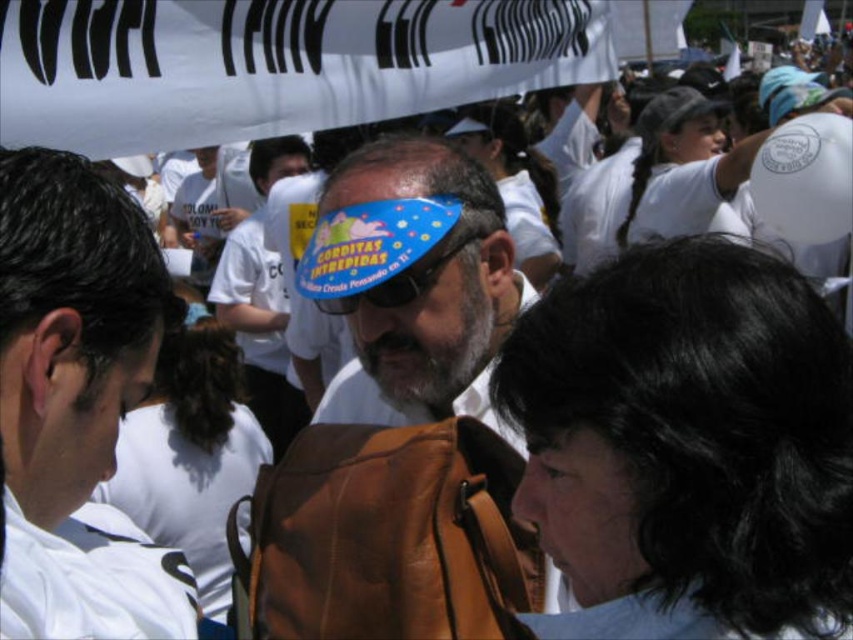
Which is more to the left, white leather shirt at center or blue plastic goggles at center?

Positioned to the left is white leather shirt at center.

Is the position of white leather shirt at center less distant than that of blue plastic goggles at center?

Yes, white leather shirt at center is closer to the viewer.

This screenshot has width=853, height=640. Find the location of `white leather shirt at center`. white leather shirt at center is located at coordinates (74, 401).

Can you confirm if white leather shirt at center is positioned to the left of white t-shirt at center?

No, white leather shirt at center is not to the left of white t-shirt at center.

Is point (47, 163) positioned in front of point (218, 296)?

Yes, point (47, 163) is closer to viewer.

Find the location of `white leather shirt at center`. white leather shirt at center is located at coordinates (74, 401).

Does blue paper mask at center have a smaller size compared to blue plastic goggles at center?

Actually, blue paper mask at center might be larger than blue plastic goggles at center.

Which is behind, point (503, 241) or point (358, 300)?

Point (503, 241)

Where is `blue paper mask at center`? blue paper mask at center is located at coordinates click(x=413, y=284).